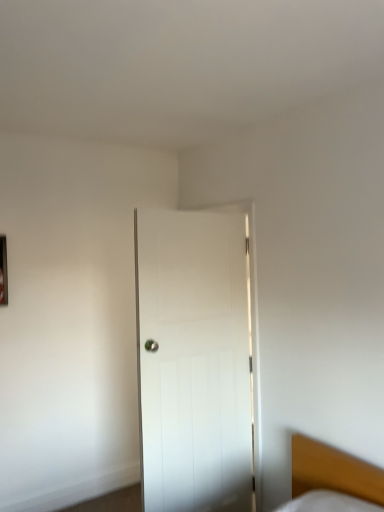
In order to face wooden bed at lower right, should I rotate leftwards or rightwards?

You should look right and rotate roughly 16.901 degrees.

The height and width of the screenshot is (512, 384). I want to click on white wooden door at center, so click(x=196, y=359).

Where is `wooden bed at lower right`? wooden bed at lower right is located at coordinates (333, 472).

Does point (311, 440) lie in front of point (154, 275)?

Yes.

From the image's perspective, is wooden bed at lower right located above white wooden door at center?

Actually, wooden bed at lower right appears below white wooden door at center in the image.

Which of these two, wooden bed at lower right or white wooden door at center, is wider?

wooden bed at lower right is wider.

Between wooden bed at lower right and metallic rectangular frame at left, which one has smaller width?

With smaller width is metallic rectangular frame at left.

How different are the orientations of wooden bed at lower right and metallic rectangular frame at left in degrees?

90.6 degrees separate the facing orientations of wooden bed at lower right and metallic rectangular frame at left.

Based on the photo, which object is more forward, wooden bed at lower right or metallic rectangular frame at left?

wooden bed at lower right.

What are the coordinates of `bed located on the right of metallic rectangular frame at left` in the screenshot? It's located at (333, 472).

From the picture: From a real-world perspective, relative to white wooden door at center, is metallic rectangular frame at left vertically above or below?

metallic rectangular frame at left is above white wooden door at center.

Which is closer to the camera, (2, 281) or (219, 266)?

The point (219, 266) is closer.

Locate an element on the screen. The width and height of the screenshot is (384, 512). door directly beneath the metallic rectangular frame at left (from a real-world perspective) is located at coordinates (196, 359).

From the image's perspective, between metallic rectangular frame at left and white wooden door at center, which one is located above?

metallic rectangular frame at left, from the image's perspective.

Which object is positioned more to the right, metallic rectangular frame at left or wooden bed at lower right?

wooden bed at lower right is more to the right.

Who is smaller, metallic rectangular frame at left or wooden bed at lower right?

With smaller size is metallic rectangular frame at left.

Is metallic rectangular frame at left far away from wooden bed at lower right?

metallic rectangular frame at left is far away from wooden bed at lower right.

Which is behind, metallic rectangular frame at left or wooden bed at lower right?

metallic rectangular frame at left is further from the camera.

Is white wooden door at center positioned with its back to wooden bed at lower right?

Absolutely, white wooden door at center is directed away from wooden bed at lower right.

Who is bigger, white wooden door at center or wooden bed at lower right?

white wooden door at center.

Is white wooden door at center touching wooden bed at lower right?

No, white wooden door at center is not making contact with wooden bed at lower right.

Would you say white wooden door at center is a long distance from metallic rectangular frame at left?

Yes, white wooden door at center is far from metallic rectangular frame at left.

Considering the positions of objects white wooden door at center and metallic rectangular frame at left in the image provided, who is more to the left, white wooden door at center or metallic rectangular frame at left?

metallic rectangular frame at left.

In terms of size, does white wooden door at center appear bigger or smaller than metallic rectangular frame at left?

In the image, white wooden door at center appears to be larger than metallic rectangular frame at left.

Which object is closer to the camera taking this photo, white wooden door at center or metallic rectangular frame at left?

white wooden door at center is in front.

Locate an element on the screen. This screenshot has width=384, height=512. door that appears behind the wooden bed at lower right is located at coordinates (196, 359).

Identify the location of picture frame that is above the wooden bed at lower right (from the image's perspective). (3, 271).

From the image, which object appears to be nearer to metallic rectangular frame at left, wooden bed at lower right or white wooden door at center?

The object closer to metallic rectangular frame at left is white wooden door at center.

Looking at the image, which one is located closer to white wooden door at center, wooden bed at lower right or metallic rectangular frame at left?

wooden bed at lower right.

When comparing their distances from wooden bed at lower right, does white wooden door at center or metallic rectangular frame at left seem closer?

Based on the image, white wooden door at center appears to be nearer to wooden bed at lower right.

Based on their spatial positions, is metallic rectangular frame at left or white wooden door at center closer to wooden bed at lower right?

Among the two, white wooden door at center is located nearer to wooden bed at lower right.

Looking at the image, which one is located closer to metallic rectangular frame at left, white wooden door at center or wooden bed at lower right?

Among the two, white wooden door at center is located nearer to metallic rectangular frame at left.

Based on their spatial positions, is metallic rectangular frame at left or wooden bed at lower right closer to white wooden door at center?

wooden bed at lower right.

Identify the location of door situated between metallic rectangular frame at left and wooden bed at lower right from left to right. This screenshot has width=384, height=512. (196, 359).